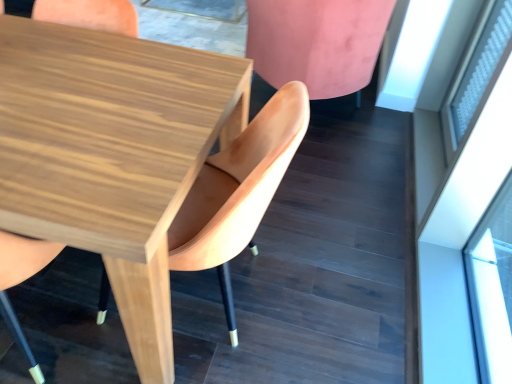
Question: Is wooden table at center in front of or behind transparent glass door at upper right in the image?

Choices:
 (A) behind
 (B) front

Answer: (B)

Question: From the image's perspective, is wooden table at center above or below transparent glass door at upper right?

Choices:
 (A) below
 (B) above

Answer: (A)

Question: Based on their relative distances, which object is nearer to the transparent glass door at upper right?

Choices:
 (A) white frosted glass at upper right
 (B) pink velvet chair at upper right, which ranks as the first chair in right-to-left order
 (C) wooden table at center
 (D) wooden chair at center, the 2th chair from the right
 (E) wooden chair at center, the first chair positioned from the left

Answer: (A)

Question: Which is nearer to the wooden chair at center, the 2th chair from the left?

Choices:
 (A) pink velvet chair at upper right, which ranks as the first chair in right-to-left order
 (B) wooden chair at center, the first chair positioned from the left
 (C) wooden table at center
 (D) transparent glass door at upper right
 (E) white frosted glass at upper right

Answer: (C)